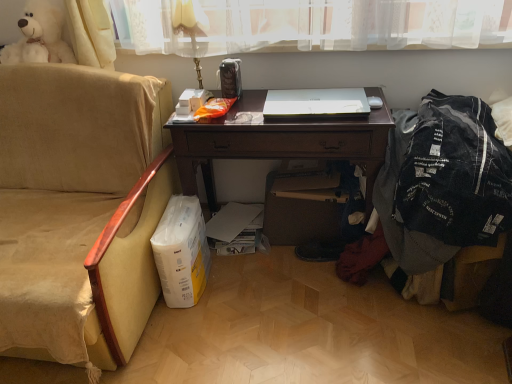
Question: In terms of height, does white glossy laptop at center look taller or shorter compared to denim jacket at right?

Choices:
 (A) tall
 (B) short

Answer: (B)

Question: Considering the positions of point (309, 92) and point (480, 130), is point (309, 92) closer or farther from the camera than point (480, 130)?

Choices:
 (A) farther
 (B) closer

Answer: (A)

Question: Which is nearer to the white glossy laptop at center?

Choices:
 (A) gold metallic table lamp at upper center
 (B) dark wood desk at center
 (C) beige fabric chair at left
 (D) white plush bear at upper left
 (E) denim jacket at right

Answer: (B)

Question: Which object is positioned farthest from the denim jacket at right?

Choices:
 (A) white glossy laptop at center
 (B) dark wood desk at center
 (C) gold metallic table lamp at upper center
 (D) white plush bear at upper left
 (E) beige fabric chair at left

Answer: (D)